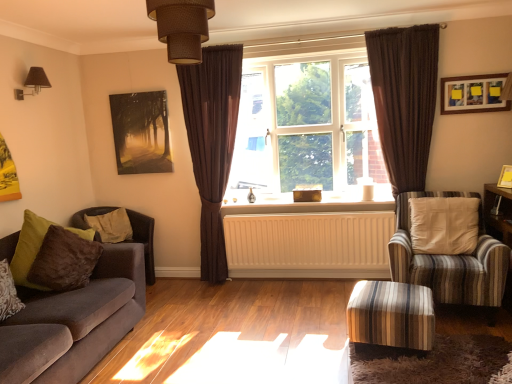
Image resolution: width=512 pixels, height=384 pixels. Find the location of `blank space above brown textured curtain at right, marked as the first curtain in a right-to-left arrangement (from a real-world perspective)`. blank space above brown textured curtain at right, marked as the first curtain in a right-to-left arrangement (from a real-world perspective) is located at coordinates (399, 26).